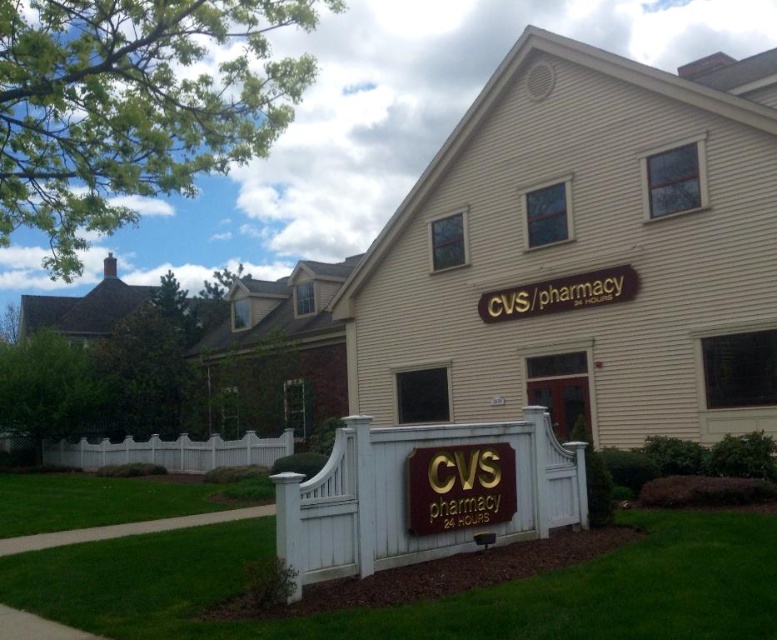
Who is lower down, gold metallic cvs pharmacy sign at center or white picket fence at lower left?

white picket fence at lower left

Where is `gold metallic cvs pharmacy sign at center`? This screenshot has width=777, height=640. gold metallic cvs pharmacy sign at center is located at coordinates pyautogui.click(x=458, y=486).

Is point (488, 486) farther from camera compared to point (157, 452)?

No.

At what (x,y) coordinates should I click in order to perform the action: click on gold metallic cvs pharmacy sign at center. Please return your answer as a coordinate pair (x, y). Image resolution: width=777 pixels, height=640 pixels. Looking at the image, I should click on (458, 486).

The image size is (777, 640). I want to click on white wood fence at center, so click(x=423, y=493).

Is point (448, 426) closer to viewer compared to point (82, 467)?

Yes, it is in front of point (82, 467).

Identify the location of white wood fence at center. (423, 493).

Between point (373, 464) and point (430, 486), which one is positioned in front?

Positioned in front is point (373, 464).

Does white wood fence at center appear over gold metallic cvs pharmacy sign at center?

Yes, white wood fence at center is above gold metallic cvs pharmacy sign at center.

This screenshot has height=640, width=777. I want to click on white wood fence at center, so click(x=423, y=493).